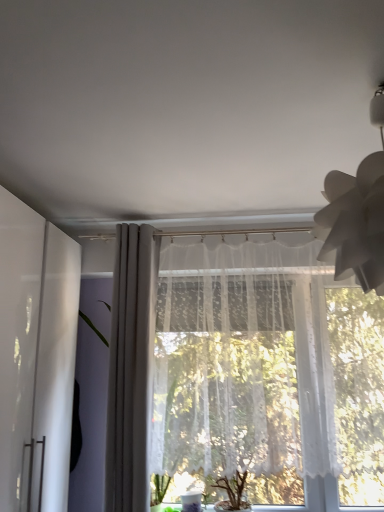
Question: From the image's perspective, is white paper lampshade at upper right located above white glossy cabinet at left?

Choices:
 (A) yes
 (B) no

Answer: (A)

Question: Is white paper lampshade at upper right thinner than white glossy cabinet at left?

Choices:
 (A) yes
 (B) no

Answer: (A)

Question: Does white paper lampshade at upper right have a lesser height compared to white glossy cabinet at left?

Choices:
 (A) no
 (B) yes

Answer: (B)

Question: Is white paper lampshade at upper right in contact with white glossy cabinet at left?

Choices:
 (A) yes
 (B) no

Answer: (B)

Question: Is white paper lampshade at upper right completely or partially outside of white glossy cabinet at left?

Choices:
 (A) no
 (B) yes

Answer: (B)

Question: Considering the positions of white glossy cabinet at left and white paper lampshade at upper right in the image, is white glossy cabinet at left wider or thinner than white paper lampshade at upper right?

Choices:
 (A) wide
 (B) thin

Answer: (A)

Question: From a real-world perspective, relative to white paper lampshade at upper right, is white glossy cabinet at left vertically above or below?

Choices:
 (A) above
 (B) below

Answer: (B)

Question: Choose the correct answer: Is white glossy cabinet at left inside white paper lampshade at upper right or outside it?

Choices:
 (A) outside
 (B) inside

Answer: (A)

Question: In terms of size, does white glossy cabinet at left appear bigger or smaller than white paper lampshade at upper right?

Choices:
 (A) big
 (B) small

Answer: (A)

Question: Is white glossy cabinet at left taller or shorter than white sheer curtain at center, the 2th curtain when ordered from right to left?

Choices:
 (A) tall
 (B) short

Answer: (B)

Question: From a real-world perspective, is white glossy cabinet at left above or below white sheer curtain at center, the 2th curtain when ordered from right to left?

Choices:
 (A) above
 (B) below

Answer: (B)

Question: Is white glossy cabinet at left wider or thinner than white sheer curtain at center, the 2th curtain when ordered from right to left?

Choices:
 (A) wide
 (B) thin

Answer: (A)

Question: Looking at the image, does white glossy cabinet at left seem bigger or smaller compared to white sheer curtain at center, positioned as the 1th curtain in left-to-right order?

Choices:
 (A) small
 (B) big

Answer: (B)

Question: Relative to white lace curtain at center, which is the 1th curtain in right-to-left order, is white glossy cabinet at left in front or behind?

Choices:
 (A) behind
 (B) front

Answer: (B)

Question: Would you say white glossy cabinet at left is inside or outside white lace curtain at center, which is the 1th curtain in right-to-left order?

Choices:
 (A) inside
 (B) outside

Answer: (B)